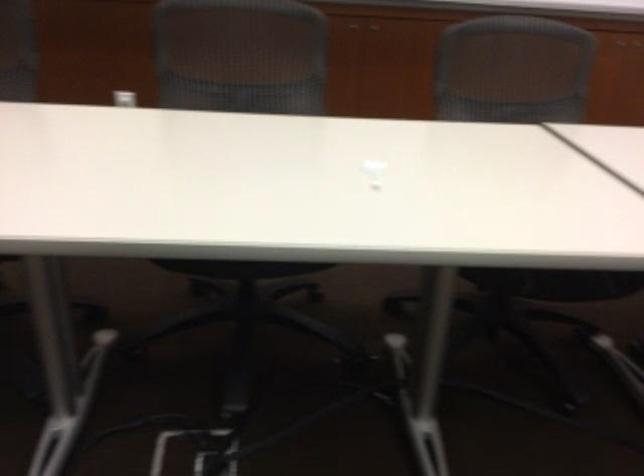
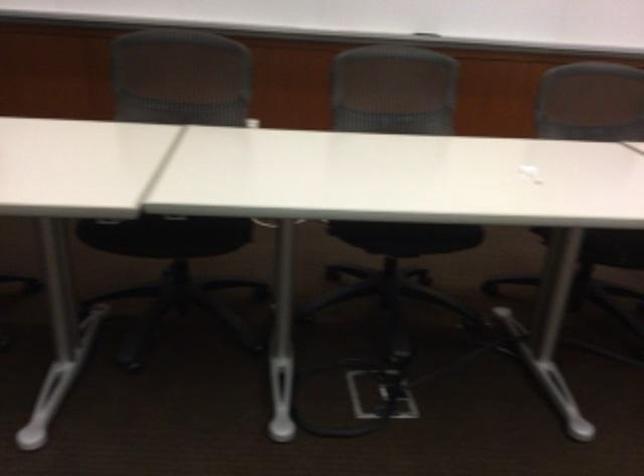
In a continuous first-person perspective shot, in which direction is the camera moving?

The cameraman walked toward left, backward.